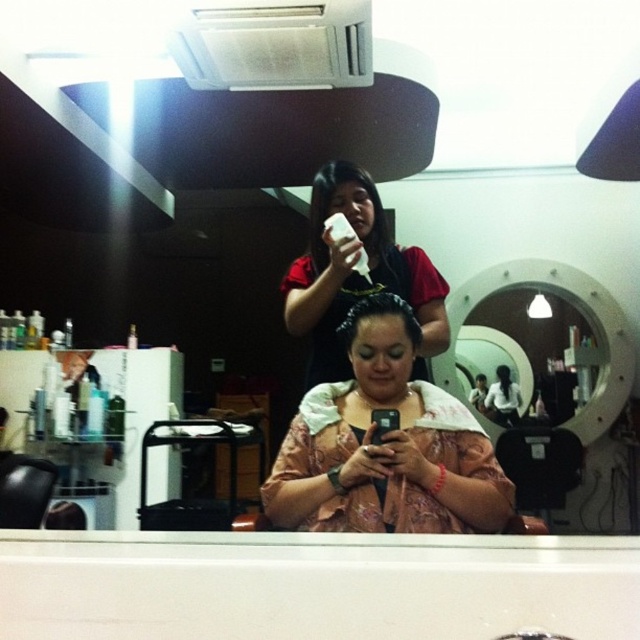
You are a customer in a hair salon. You notice the brown matte hair at center and the matte black phone at center. Which object is nearer to you?

The brown matte hair at center is closer to the viewer than the matte black phone at center.

You are a customer in a hair salon and want to check your reflection in the glossy white mirror at center. Where should you look to see your reflection?

You should look at the glossy white mirror at center located at point (x=515, y=333) to see your reflection.

You are a customer in a hair salon. You want to check your hair style in the glossy white mirror at center while sitting in the chair. Can you see your entire brown matte hair at center in the mirror?

The glossy white mirror at center is taller than brown matte hair at center, so yes, you can see your entire brown matte hair at center in the mirror since the mirror is taller than the hair.